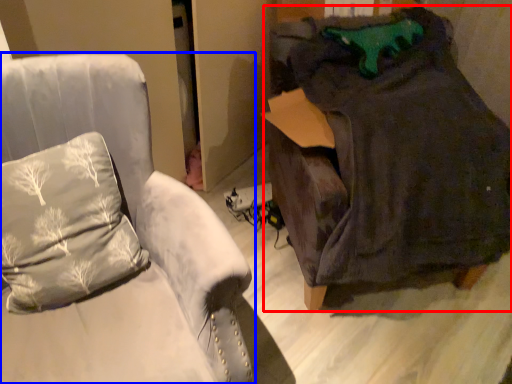
Question: Which object is further to the camera taking this photo, bean bag chair (highlighted by a red box) or furniture (highlighted by a blue box)?

Choices:
 (A) bean bag chair
 (B) furniture

Answer: (A)